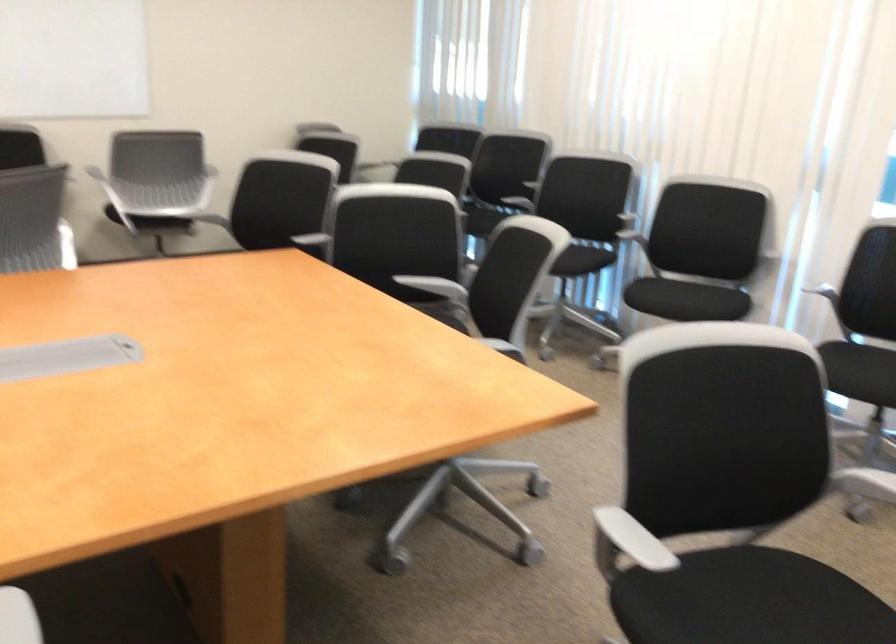
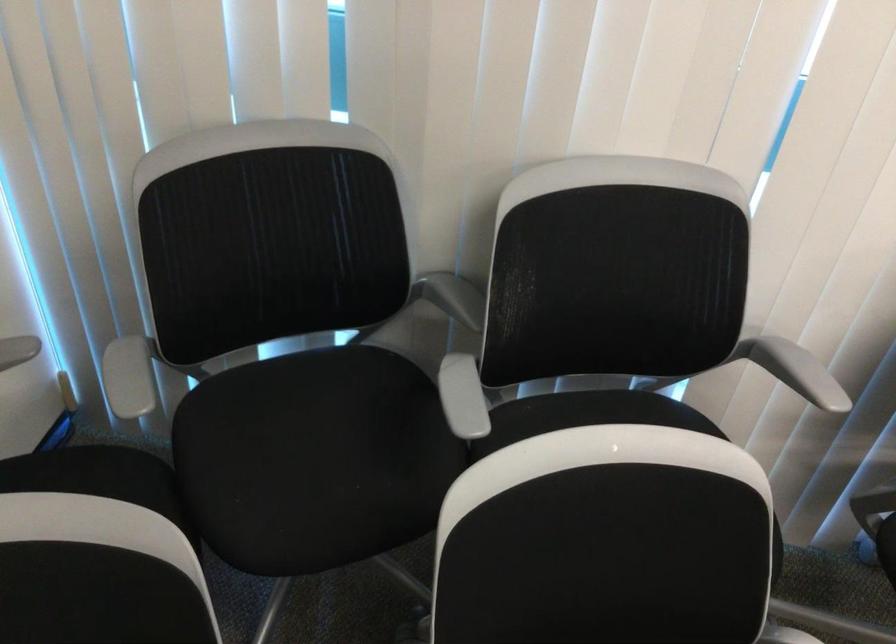
Find the pixel in the second image that matches point (538, 173) in the first image.

(794, 370)